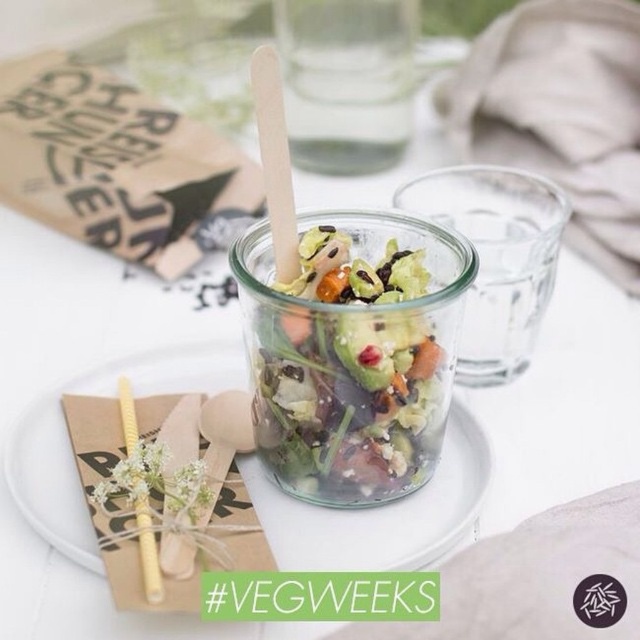
Between clear glass plate at center and clear glass jar at center, which one has less height?

With less height is clear glass plate at center.

Image resolution: width=640 pixels, height=640 pixels. Find the location of `clear glass plate at center`. clear glass plate at center is located at coordinates (381, 513).

Where is `clear glass plate at center`? The height and width of the screenshot is (640, 640). clear glass plate at center is located at coordinates (381, 513).